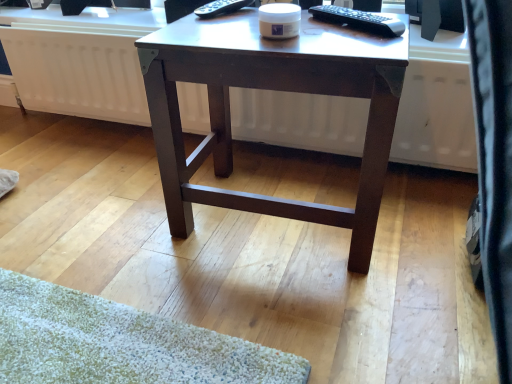
In order to face black glossy monitor at upper right, should I rotate leftwards or rightwards?

Rotate your view right by about 21.868°.

In the scene shown: Measure the distance between point (422, 16) and camera.

1.17 meters.

What do you see at coordinates (220, 8) in the screenshot? Image resolution: width=512 pixels, height=384 pixels. I see `black plastic remote control at upper center, the 1th remote control positioned from the back` at bounding box center [220, 8].

This screenshot has width=512, height=384. Describe the element at coordinates (359, 20) in the screenshot. I see `black plastic remote control at upper right, the second remote control when ordered from back to front` at that location.

The width and height of the screenshot is (512, 384). What are the coordinates of `black glossy monitor at upper right` in the screenshot? It's located at (436, 16).

Is dark brown wood desk at center a part of black glossy monitor at upper right?

That's incorrect, dark brown wood desk at center is not inside black glossy monitor at upper right.

In terms of height, does black glossy monitor at upper right look taller or shorter compared to dark brown wood desk at center?

black glossy monitor at upper right is shorter than dark brown wood desk at center.

How many degrees apart are the facing directions of black glossy monitor at upper right and dark brown wood desk at center?

22.7 degrees separate the facing orientations of black glossy monitor at upper right and dark brown wood desk at center.

Considering the relative sizes of black glossy monitor at upper right and dark brown wood desk at center in the image provided, is black glossy monitor at upper right smaller than dark brown wood desk at center?

Yes, black glossy monitor at upper right is smaller than dark brown wood desk at center.

Can you confirm if dark brown wood desk at center is positioned to the left of black plastic remote control at upper center, marked as the 1th remote control in a left-to-right arrangement?

No, dark brown wood desk at center is not to the left of black plastic remote control at upper center, marked as the 1th remote control in a left-to-right arrangement.

Is black plastic remote control at upper center, the 1th remote control positioned from the back, completely or partially inside dark brown wood desk at center?

Actually, black plastic remote control at upper center, the 1th remote control positioned from the back, is outside dark brown wood desk at center.

Is dark brown wood desk at center oriented towards black plastic remote control at upper center, which is the second remote control in front-to-back order?

No.

Who is taller, dark brown wood desk at center or black plastic remote control at upper center, which is the second remote control in front-to-back order?

With more height is dark brown wood desk at center.

At what (x,y) coordinates should I click in order to perform the action: click on remote control behind the black plastic remote control at upper right, the second remote control when ordered from back to front. Please return your answer as a coordinate pair (x, y). This screenshot has width=512, height=384. Looking at the image, I should click on (220, 8).

Looking at their sizes, would you say black plastic remote control at upper right, the second remote control when ordered from back to front, is wider or thinner than black plastic remote control at upper center, marked as the 1th remote control in a left-to-right arrangement?

Considering their sizes, black plastic remote control at upper right, the second remote control when ordered from back to front, looks slimmer than black plastic remote control at upper center, marked as the 1th remote control in a left-to-right arrangement.

Which object is more forward, dark brown wood desk at center or white matte radiator at center?

dark brown wood desk at center.

Does dark brown wood desk at center have a larger size compared to white matte radiator at center?

Yes.

How much distance is there between dark brown wood desk at center and white matte radiator at center?

dark brown wood desk at center and white matte radiator at center are 19.63 inches apart.

Find the location of a particular element. The width and height of the screenshot is (512, 384). radiator on the left of dark brown wood desk at center is located at coordinates (77, 73).

Looking at this image, would you say black plastic remote control at upper center, marked as the 1th remote control in a left-to-right arrangement, is outside dark brown wood desk at center?

Yes, black plastic remote control at upper center, marked as the 1th remote control in a left-to-right arrangement, is outside of dark brown wood desk at center.

Which of these two, black plastic remote control at upper center, marked as the 1th remote control in a left-to-right arrangement, or dark brown wood desk at center, is bigger?

With larger size is dark brown wood desk at center.

From the image's perspective, is black plastic remote control at upper center, marked as the 1th remote control in a left-to-right arrangement, on dark brown wood desk at center?

Yes, from the image's perspective, black plastic remote control at upper center, marked as the 1th remote control in a left-to-right arrangement, is above dark brown wood desk at center.

Measure the distance between black plastic remote control at upper center, marked as the 1th remote control in a left-to-right arrangement, and dark brown wood desk at center.

A distance of 11.81 inches exists between black plastic remote control at upper center, marked as the 1th remote control in a left-to-right arrangement, and dark brown wood desk at center.

From a real-world perspective, relative to black plastic remote control at upper center, marked as the 1th remote control in a left-to-right arrangement, is white matte radiator at center vertically above or below?

white matte radiator at center is situated lower than black plastic remote control at upper center, marked as the 1th remote control in a left-to-right arrangement, in the real world.

Looking at this image, considering the sizes of objects white matte radiator at center and black plastic remote control at upper center, which is the second remote control in front-to-back order, in the image provided, who is smaller, white matte radiator at center or black plastic remote control at upper center, which is the second remote control in front-to-back order,?

Smaller between the two is black plastic remote control at upper center, which is the second remote control in front-to-back order.

Is the surface of white matte radiator at center in direct contact with black plastic remote control at upper center, the 2th remote control from the right?

No, white matte radiator at center is not in contact with black plastic remote control at upper center, the 2th remote control from the right.

Does white matte radiator at center contain black plastic remote control at upper center, marked as the 1th remote control in a left-to-right arrangement?

No, black plastic remote control at upper center, marked as the 1th remote control in a left-to-right arrangement, is not a part of white matte radiator at center.

Is black plastic remote control at upper center, marked as the 1th remote control in a left-to-right arrangement, looking in the opposite direction of white matte radiator at center?

No, white matte radiator at center is not at the back of black plastic remote control at upper center, marked as the 1th remote control in a left-to-right arrangement.

Does black plastic remote control at upper center, the 2th remote control from the right, have a greater width compared to white matte radiator at center?

Yes, black plastic remote control at upper center, the 2th remote control from the right, is wider than white matte radiator at center.

From a real-world perspective, is black plastic remote control at upper center, the 2th remote control from the right, positioned over white matte radiator at center based on gravity?

Yes, from a real-world perspective, black plastic remote control at upper center, the 2th remote control from the right, is over white matte radiator at center

This screenshot has height=384, width=512. I want to click on desk on the left of black glossy monitor at upper right, so click(274, 90).

Find the location of a particular element. Image resolution: width=512 pixels, height=384 pixels. the 2nd remote control behind the dark brown wood desk at center, counting from the anchor's position is located at coordinates (220, 8).

Which object lies further to the anchor point white matte radiator at center, black plastic remote control at upper right, the second remote control in the left-to-right sequence, or black glossy monitor at upper right?

black glossy monitor at upper right lies further to white matte radiator at center than the other object.

Which object lies further to the anchor point black glossy monitor at upper right, dark brown wood desk at center or white matte radiator at center?

white matte radiator at center.

When comparing their distances from white matte radiator at center, does dark brown wood desk at center or black plastic remote control at upper right, positioned as the 1th remote control in front-to-back order, seem closer?

dark brown wood desk at center is closer to white matte radiator at center.

Which object lies further to the anchor point white matte radiator at center, black plastic remote control at upper center, which is the second remote control in front-to-back order, or black plastic remote control at upper right, the second remote control in the left-to-right sequence?

black plastic remote control at upper right, the second remote control in the left-to-right sequence, lies further to white matte radiator at center than the other object.

Looking at the image, which one is located further to black plastic remote control at upper right, positioned as the 1th remote control in front-to-back order, white matte radiator at center or black glossy monitor at upper right?

white matte radiator at center is further to black plastic remote control at upper right, positioned as the 1th remote control in front-to-back order.

Looking at the image, which one is located closer to white matte radiator at center, dark brown wood desk at center or black plastic remote control at upper center, which is the second remote control in front-to-back order?

dark brown wood desk at center is positioned closer to the anchor white matte radiator at center.

Looking at the image, which one is located further to black glossy monitor at upper right, black plastic remote control at upper right, the second remote control when ordered from back to front, or white matte radiator at center?

Based on the image, white matte radiator at center appears to be further to black glossy monitor at upper right.

From the image, which object appears to be nearer to black glossy monitor at upper right, black plastic remote control at upper center, the 2th remote control from the right, or dark brown wood desk at center?

Based on the image, black plastic remote control at upper center, the 2th remote control from the right, appears to be nearer to black glossy monitor at upper right.

Identify the location of remote control between dark brown wood desk at center and black glossy monitor at upper right from left to right. The width and height of the screenshot is (512, 384). (359, 20).

I want to click on remote control between white matte radiator at center and dark brown wood desk at center from left to right, so pos(220,8).

The height and width of the screenshot is (384, 512). Find the location of `desk located between black plastic remote control at upper center, the 2th remote control from the right, and black glossy monitor at upper right in the left-right direction`. desk located between black plastic remote control at upper center, the 2th remote control from the right, and black glossy monitor at upper right in the left-right direction is located at coordinates (274, 90).

You are a GUI agent. You are given a task and a screenshot of the screen. Output one action in this format:
    pyautogui.click(x=<x>, y=<y>)
    Task: Click on the remote control between black plastic remote control at upper center, the 2th remote control from the right, and dark brown wood desk at center vertically
    Image resolution: width=512 pixels, height=384 pixels.
    Given the screenshot: What is the action you would take?
    pyautogui.click(x=359, y=20)